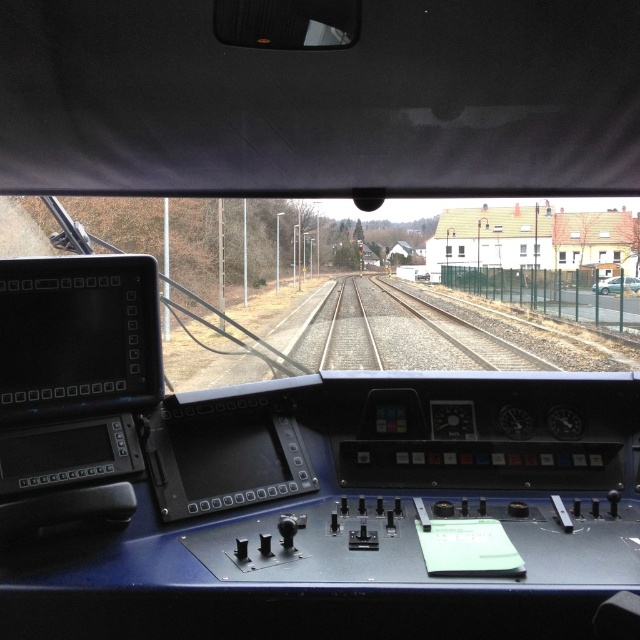
You are a train conductor checking the tracks ahead. You see the smooth metal train track at center and the metallic silver car at right. Which object is positioned to the left of the other?

The smooth metal train track at center is to the left of the metallic silver car at right.

You are a train engineer who needs to ensure there are no obstructions on the tracks ahead. Based on the scene, is the metallic silver car at right blocking the smooth metal train track at center?

The smooth metal train track at center is located below the metallic silver car at right, meaning the car is positioned above the track. This suggests the car is not on the tracks but perhaps alongside them, so it is not blocking the smooth metal train track at center.

You are a train engineer inside the cab. You notice a point marked at coordinates (401, 333). What surface is this point located on?

The point at (401, 333) is located on the smooth metal train track at center.